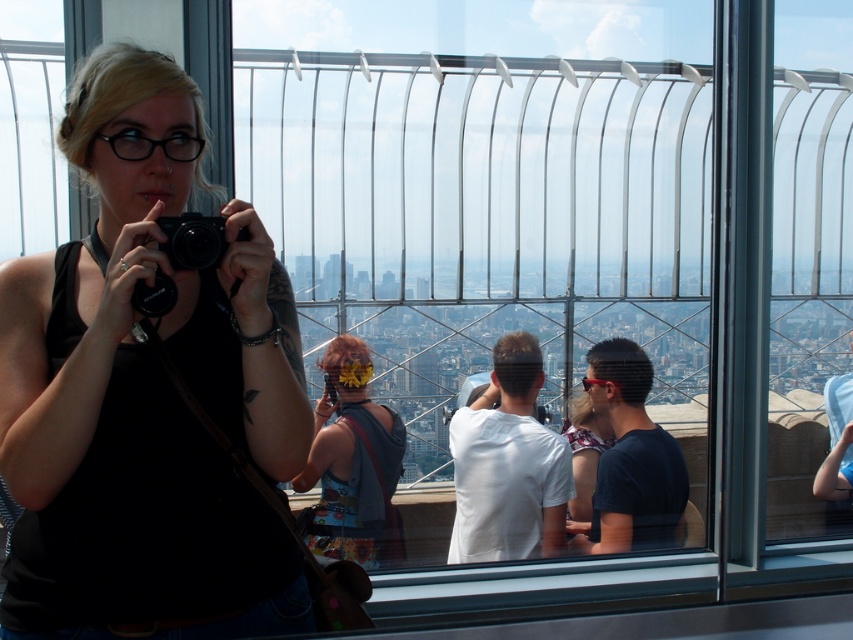
Question: Is the position of white matte shirt at center less distant than that of black matte camera at center?

Choices:
 (A) no
 (B) yes

Answer: (A)

Question: Which object is farther from the camera taking this photo?

Choices:
 (A) matte black camera at left
 (B) white matte shirt at center
 (C) floral dress at center

Answer: (C)

Question: Which point is closer to the camera?

Choices:
 (A) black matte camera at center
 (B) black plastic camera at center

Answer: (A)

Question: Which point is farther to the camera?

Choices:
 (A) (492, 406)
 (B) (135, 289)
 (C) (166, 234)
 (D) (355, 410)

Answer: (A)

Question: In this image, where is white matte shirt at center located relative to black matte camera at center?

Choices:
 (A) above
 (B) below

Answer: (B)

Question: Can you confirm if black matte camera at center is wider than black plastic camera at center?

Choices:
 (A) yes
 (B) no

Answer: (A)